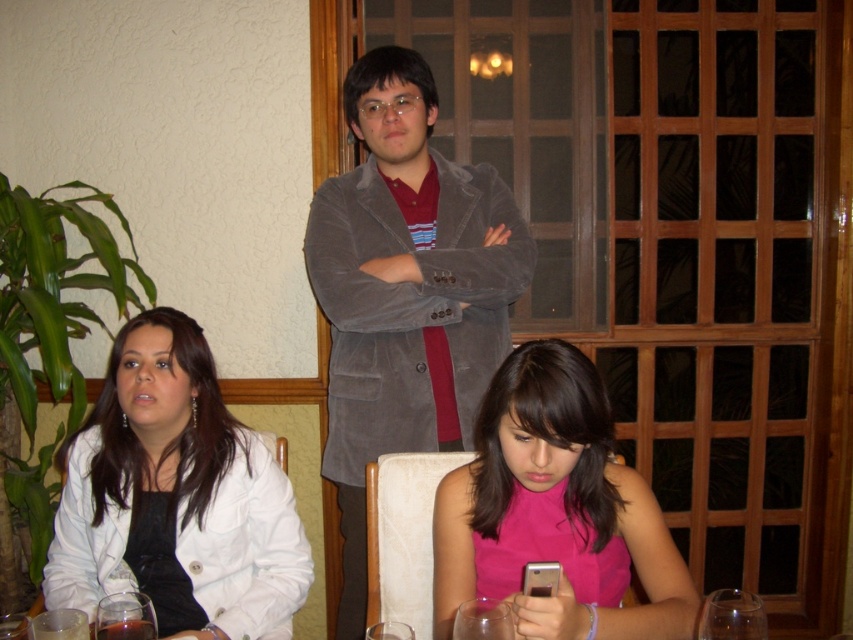
Between suede blazer at center and white matte jacket at lower left, which one appears on the left side from the viewer's perspective?

From the viewer's perspective, white matte jacket at lower left appears more on the left side.

Is suede blazer at center thinner than white matte jacket at lower left?

In fact, suede blazer at center might be wider than white matte jacket at lower left.

Measure the distance between point [445,326] and camera.

Point [445,326] and camera are 2.02 meters apart.

Find the location of `suede blazer at center`. suede blazer at center is located at coordinates (405, 291).

Does white matte jacket at lower left have a lesser width compared to pink satin dress at center?

In fact, white matte jacket at lower left might be wider than pink satin dress at center.

Locate an element on the screen. white matte jacket at lower left is located at coordinates (177, 497).

The height and width of the screenshot is (640, 853). Find the location of `white matte jacket at lower left`. white matte jacket at lower left is located at coordinates pos(177,497).

This screenshot has height=640, width=853. Find the location of `white matte jacket at lower left`. white matte jacket at lower left is located at coordinates (177, 497).

Does suede blazer at center have a greater height compared to pink satin dress at center?

Yes, suede blazer at center is taller than pink satin dress at center.

What do you see at coordinates (405, 291) in the screenshot?
I see `suede blazer at center` at bounding box center [405, 291].

The height and width of the screenshot is (640, 853). What are the coordinates of `suede blazer at center` in the screenshot? It's located at [405, 291].